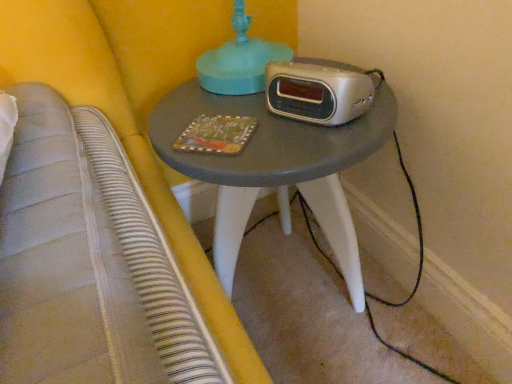
Identify the location of vacant space behind wooden painted book at center. The height and width of the screenshot is (384, 512). (211, 97).